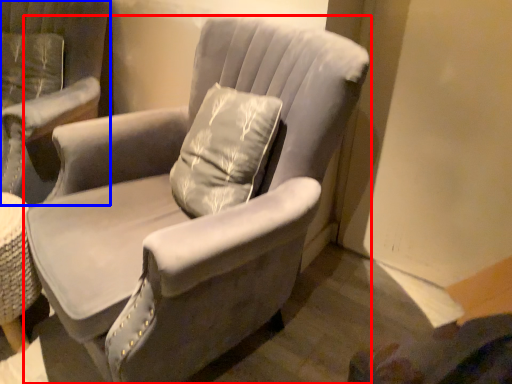
Question: Which object is further to the camera taking this photo, chair (highlighted by a red box) or chair (highlighted by a blue box)?

Choices:
 (A) chair
 (B) chair

Answer: (B)